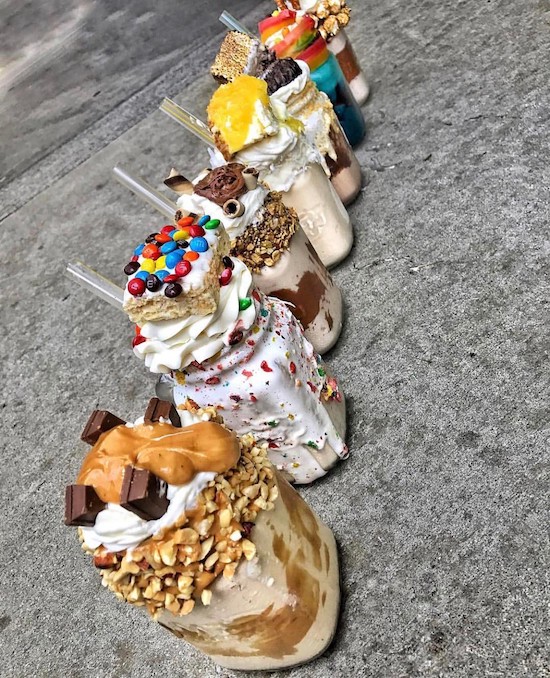
I want to click on glass, so click(268, 605).